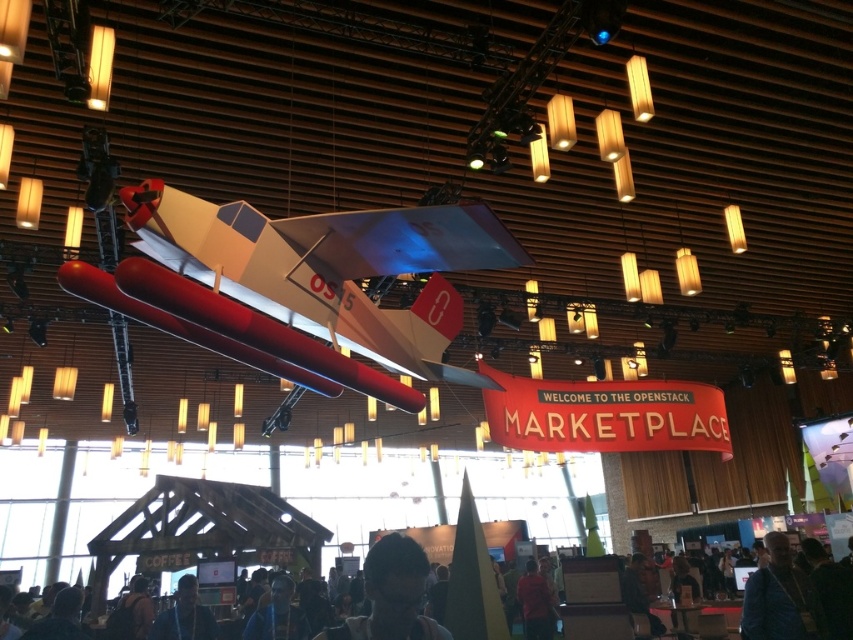
Question: Does matte white airplane at center appear on the left side of dark blue shirt at lower center?

Choices:
 (A) no
 (B) yes

Answer: (A)

Question: Considering the relative positions of matte white airplane at center and dark blue shirt at lower center in the image provided, where is matte white airplane at center located with respect to dark blue shirt at lower center?

Choices:
 (A) right
 (B) left

Answer: (A)

Question: Can you confirm if blue fabric jacket at lower right is positioned above dark blue shirt at lower center?

Choices:
 (A) yes
 (B) no

Answer: (A)

Question: Among these points, which one is farthest from the camera?

Choices:
 (A) (776, 609)
 (B) (309, 216)
 (C) (534, 620)
 (D) (155, 634)

Answer: (C)

Question: Which object appears closest to the camera in this image?

Choices:
 (A) dark hair at lower center
 (B) blue fabric jacket at lower right
 (C) matte white airplane at center

Answer: (A)

Question: Which object appears farthest from the camera in this image?

Choices:
 (A) dark blue shirt at lower center
 (B) matte white airplane at center
 (C) dark hair at lower center

Answer: (A)